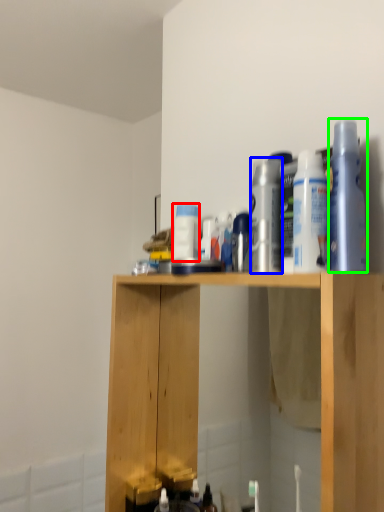
Question: Which is farther away from cleaning product (highlighted by a red box)? cleaning product (highlighted by a blue box) or cleaning product (highlighted by a green box)?

Choices:
 (A) cleaning product
 (B) cleaning product

Answer: (B)